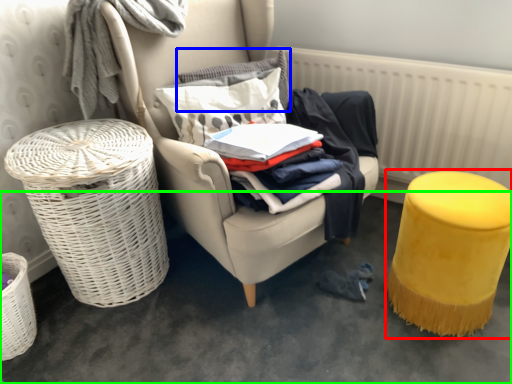
Question: Based on their relative distances, which object is farther from stool (highlighted by a red box)? Choose from pillow (highlighted by a blue box) and concrete (highlighted by a green box).

Choices:
 (A) pillow
 (B) concrete

Answer: (A)